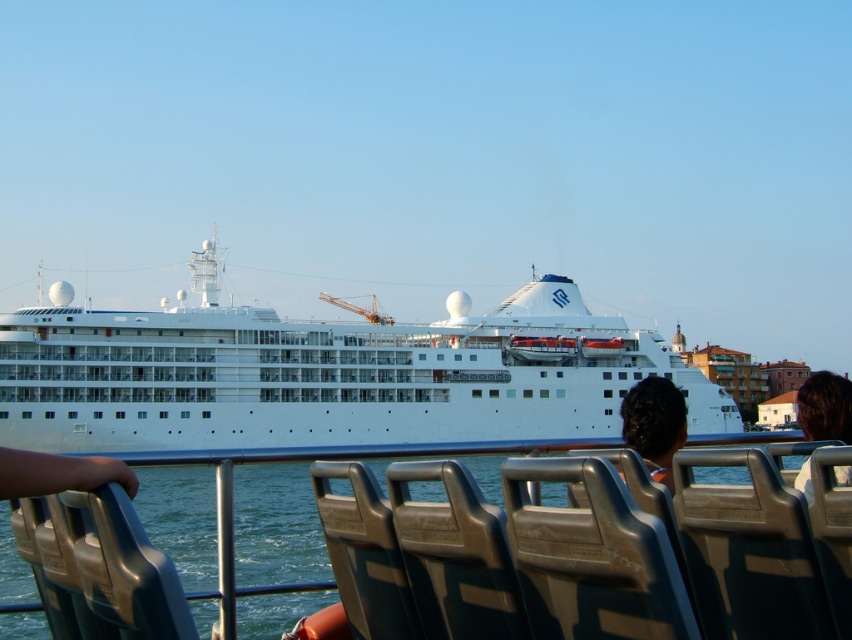
Question: Does white glossy cruise ship at center appear over matte gray seat at center?

Choices:
 (A) yes
 (B) no

Answer: (A)

Question: Which point appears farthest from the camera in this image?

Choices:
 (A) (547, 509)
 (B) (400, 465)

Answer: (B)

Question: Among these objects, which one is farthest from the camera?

Choices:
 (A) clear blue water at lower center
 (B) gray plastic chair at center

Answer: (B)

Question: Which of the following is the farthest from the observer?

Choices:
 (A) skin tone flesh arm at lower left
 (B) matte gray seat at center

Answer: (B)

Question: Does dark brown hair at center have a greater width compared to dark brown hair at upper right?

Choices:
 (A) no
 (B) yes

Answer: (B)

Question: Is clear blue water at lower center below gray plastic chair at center?

Choices:
 (A) no
 (B) yes

Answer: (B)